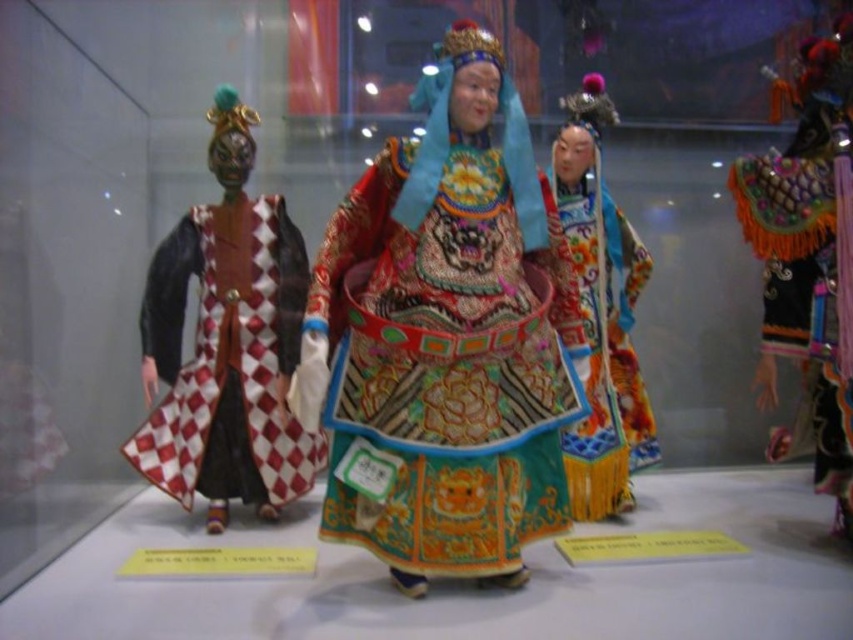
Does red and white checkered fabric at left have a greater width compared to vibrant silk robe at center?

Indeed, red and white checkered fabric at left has a greater width compared to vibrant silk robe at center.

Who is more forward, (317, 468) or (598, 196)?

Point (317, 468) is more forward.

Where is `red and white checkered fabric at left`? The height and width of the screenshot is (640, 853). red and white checkered fabric at left is located at coordinates (225, 348).

Does embroidered silk robe at center have a lesser width compared to vibrant silk robe at center?

In fact, embroidered silk robe at center might be wider than vibrant silk robe at center.

Which is in front, point (439, 381) or point (618, 230)?

Point (439, 381) is more forward.

Locate an element on the screen. This screenshot has width=853, height=640. embroidered silk robe at center is located at coordinates (445, 365).

What do you see at coordinates (445, 365) in the screenshot? I see `embroidered silk robe at center` at bounding box center [445, 365].

Is point (466, 188) farther from viewer compared to point (811, 225)?

No, it is not.

At what (x,y) coordinates should I click in order to perform the action: click on embroidered silk robe at center. Please return your answer as a coordinate pair (x, y). Image resolution: width=853 pixels, height=640 pixels. Looking at the image, I should click on (445, 365).